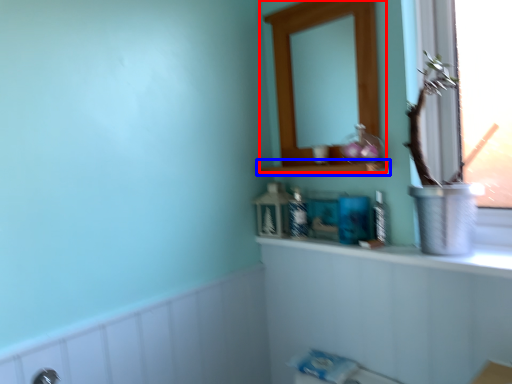
Question: Which of the following is the farthest to the observer, medicine cabinet (highlighted by a red box) or shelf (highlighted by a blue box)?

Choices:
 (A) medicine cabinet
 (B) shelf

Answer: (A)